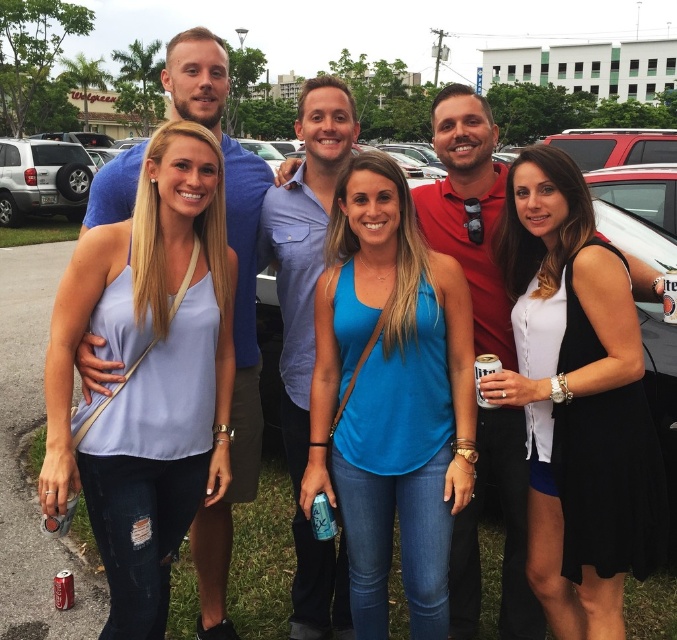
Question: Can you confirm if light blue fabric tank top at center is smaller than black sleeveless dress at center?

Choices:
 (A) no
 (B) yes

Answer: (A)

Question: Which point is closer to the camera?

Choices:
 (A) (456, 259)
 (B) (179, 392)

Answer: (B)

Question: Which is nearer to the blue shirt at center?

Choices:
 (A) light blue fabric tank top at center
 (B) silver metallic suv at left
 (C) matte red shirt at center
 (D) black sleeveless dress at center

Answer: (A)

Question: Which object appears farthest from the camera in this image?

Choices:
 (A) light blue fabric tank top at center
 (B) black sleeveless dress at center
 (C) blue fabric tank top at center

Answer: (C)

Question: Is blue fabric tank top at center above blue shirt at center?

Choices:
 (A) no
 (B) yes

Answer: (A)

Question: Is light blue fabric tank top at center bigger than silver metallic suv at left?

Choices:
 (A) no
 (B) yes

Answer: (A)